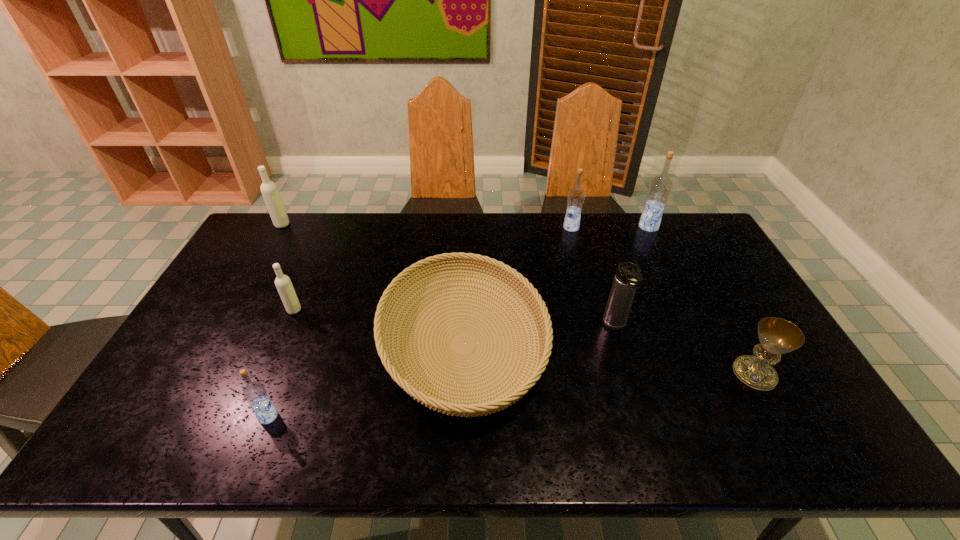
At what (x,y) coordinates should I click in order to perform the action: click on free region at the right edge. Please return your answer as a coordinate pair (x, y). Looking at the image, I should click on [x=715, y=280].

Image resolution: width=960 pixels, height=540 pixels. Find the location of `vacant space at the far right corner of the desktop`. vacant space at the far right corner of the desktop is located at coordinates (699, 240).

Find the location of `vacant area that lies between the biggest blue vodka and the chalice`. vacant area that lies between the biggest blue vodka and the chalice is located at coordinates (702, 300).

Identify the location of empty space between the right white vodka and the bigger white vodka. The width and height of the screenshot is (960, 540). (288, 267).

Identify the location of free spot between the leftmost object and the second vodka from right to left. (426, 226).

Identify the location of vacant area that lies between the leftmost vodka and the fourth object from left to right. This screenshot has height=540, width=960. pyautogui.click(x=372, y=284).

This screenshot has width=960, height=540. What are the coordinates of `free space between the second vodka from left to right and the sixth object from right to left` in the screenshot? It's located at (281, 363).

Locate which object is the sixth closest to the leftmost vodka. Please provide its 2D coordinates. Your answer should be formatted as a tuple, i.e. [(x, y)], where the tuple contains the x and y coordinates of a point satisfying the conditions above.

[(660, 187)]

Select which object is the third closest to the fourth vodka from left to right. Please provide its 2D coordinates. Your answer should be formatted as a tuple, i.e. [(x, y)], where the tuple contains the x and y coordinates of a point satisfying the conditions above.

[(627, 278)]

Identify the location of vodka that stands as the second closest to the tallest object. (283, 283).